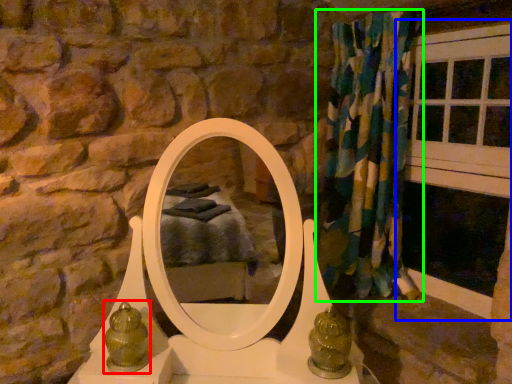
Question: Considering the real-world distances, which object is farthest from antique (highlighted by a red box)? window frame (highlighted by a blue box) or curtain (highlighted by a green box)?

Choices:
 (A) window frame
 (B) curtain

Answer: (A)